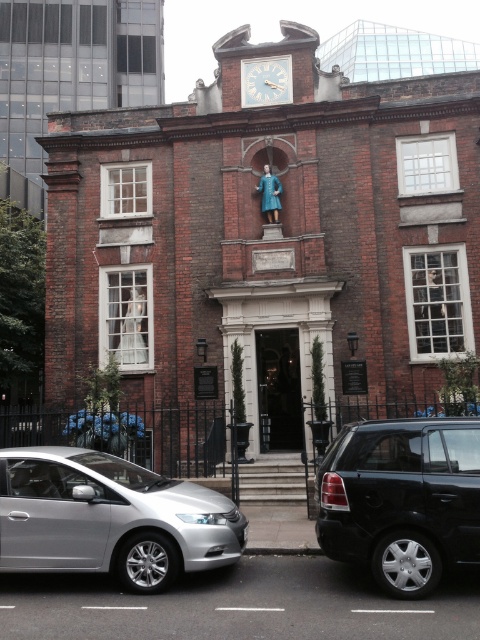
Question: Which point is farther from the camera taking this photo?

Choices:
 (A) (264, 65)
 (B) (92, 486)
 (C) (337, 440)

Answer: (A)

Question: Can you confirm if silver metallic car at lower left is bigger than black matte suv at lower right?

Choices:
 (A) no
 (B) yes

Answer: (B)

Question: Which object is closer to the camera taking this photo?

Choices:
 (A) silver metallic car at lower left
 (B) black matte suv at lower right

Answer: (B)

Question: Which point is farther from the camera taking this photo?

Choices:
 (A) (452, 536)
 (B) (273, 58)
 (C) (123, 554)

Answer: (B)

Question: Is black matte suv at lower right closer to the viewer compared to white wooden clock at upper center?

Choices:
 (A) yes
 (B) no

Answer: (A)

Question: Is black matte suv at lower right above white wooden clock at upper center?

Choices:
 (A) yes
 (B) no

Answer: (B)